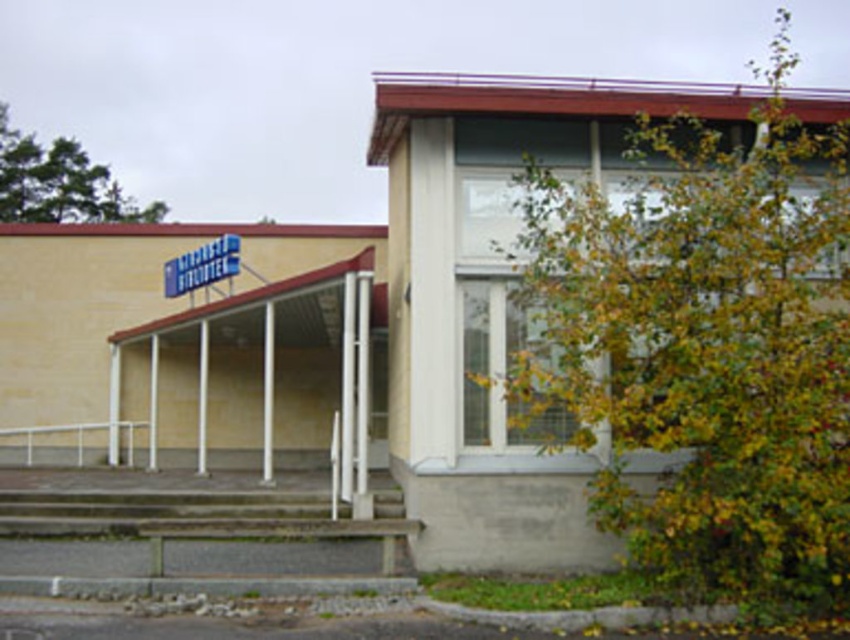
You are standing at the base of the concrete steps in front of the building. You see two points marked on the ground, one at point (176, 280) and the other at point (85, 429). Which point is closer to you?

Point (176, 280) is closer to the viewer than point (85, 429).

You are a delivery person trying to park your 12 feet long delivery van in front of the building. There is a blue plastic sign at upper left and a white plastic rail at lower left. Can you fit your van between them without touching either?

The blue plastic sign at upper left and white plastic rail at lower left are 11.80 feet apart from each other. Since the van is 12 feet long, it is slightly longer than the available space between them. Therefore, the van cannot fit between them without touching either object.